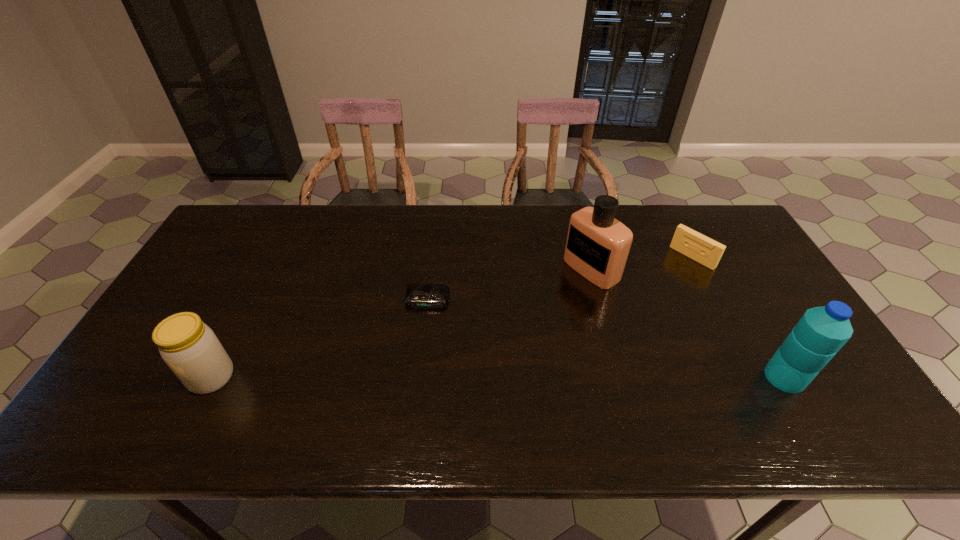
Identify the location of vacant space in between the third tallest object and the third object from right to left. (401, 323).

The height and width of the screenshot is (540, 960). I want to click on vacant area between the water bottle and the videotape, so click(x=738, y=317).

Where is `free space between the water bottle and the leftmost object`? This screenshot has height=540, width=960. free space between the water bottle and the leftmost object is located at coordinates (498, 377).

Locate an element on the screen. Image resolution: width=960 pixels, height=540 pixels. free area in between the second shortest object and the water bottle is located at coordinates (738, 317).

Find the location of a particular element. vacant space in between the second shortest object and the water bottle is located at coordinates (738, 317).

Where is `blank region between the fourth tallest object and the water bottle`? blank region between the fourth tallest object and the water bottle is located at coordinates (738, 317).

The image size is (960, 540). Find the location of `vacant space in between the second shortest object and the third object from left to right`. vacant space in between the second shortest object and the third object from left to right is located at coordinates (641, 263).

I want to click on free space between the third object from left to right and the second shortest object, so click(641, 263).

The width and height of the screenshot is (960, 540). What are the coordinates of `vacant space in between the jar and the fourth tallest object` in the screenshot? It's located at (452, 317).

Image resolution: width=960 pixels, height=540 pixels. Find the location of `free space between the videotape and the third object from left to right`. free space between the videotape and the third object from left to right is located at coordinates (641, 263).